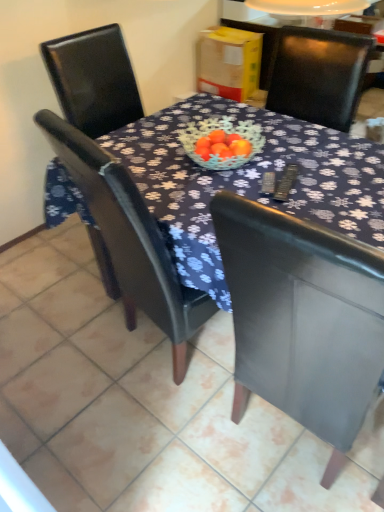
Image resolution: width=384 pixels, height=512 pixels. Identify the location of free space that is to the left of matte black chair at center, arranged as the 2th chair when viewed from the right. (56, 350).